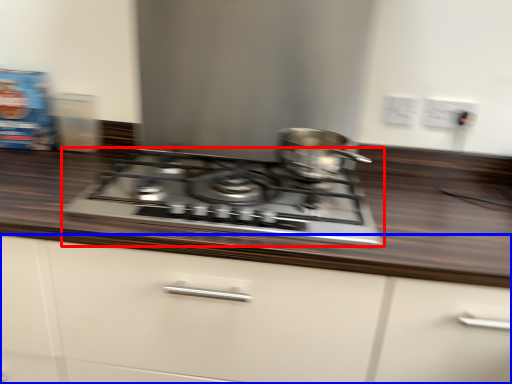
Question: Which of the following is the closest to the observer, gas stove (highlighted by a red box) or cabinetry (highlighted by a blue box)?

Choices:
 (A) gas stove
 (B) cabinetry

Answer: (B)